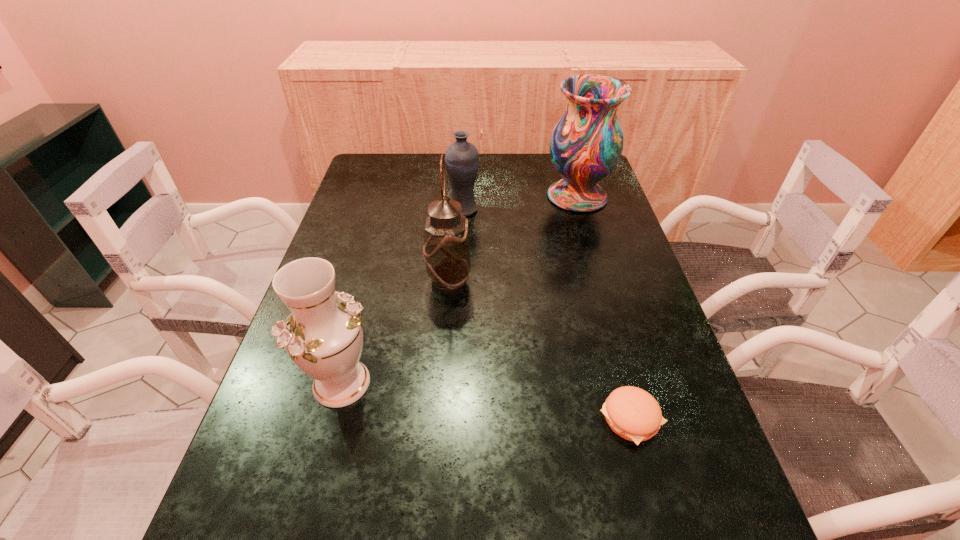
Identify the location of free space at the far left corner of the desktop. (363, 171).

Where is `empty location between the second vase from right to left and the leftmost vase`? The image size is (960, 540). empty location between the second vase from right to left and the leftmost vase is located at coordinates (402, 296).

Identify the location of free space that is in between the shortest object and the second shortest object. The height and width of the screenshot is (540, 960). (547, 314).

What are the coordinates of `free spot between the third nearest object and the third shortest object` in the screenshot? It's located at (396, 333).

Image resolution: width=960 pixels, height=540 pixels. In order to click on free spot between the third nearest object and the patty in this screenshot , I will do click(x=540, y=351).

The image size is (960, 540). Find the location of `empty location between the third tallest object and the second vase from left to right`. empty location between the third tallest object and the second vase from left to right is located at coordinates tap(402, 296).

The width and height of the screenshot is (960, 540). Find the location of `empty location between the shortest vase and the shortest object`. empty location between the shortest vase and the shortest object is located at coordinates (547, 314).

Where is `vacant area that lies between the oil lamp and the shortest object`? The width and height of the screenshot is (960, 540). vacant area that lies between the oil lamp and the shortest object is located at coordinates (540, 351).

Identify which object is the third nearest to the rightmost vase. Please provide its 2D coordinates. Your answer should be formatted as a tuple, i.e. [(x, y)], where the tuple contains the x and y coordinates of a point satisfying the conditions above.

[(632, 413)]

The image size is (960, 540). What are the coordinates of `object that ranks as the third closest to the leftmost vase` in the screenshot? It's located at (461, 158).